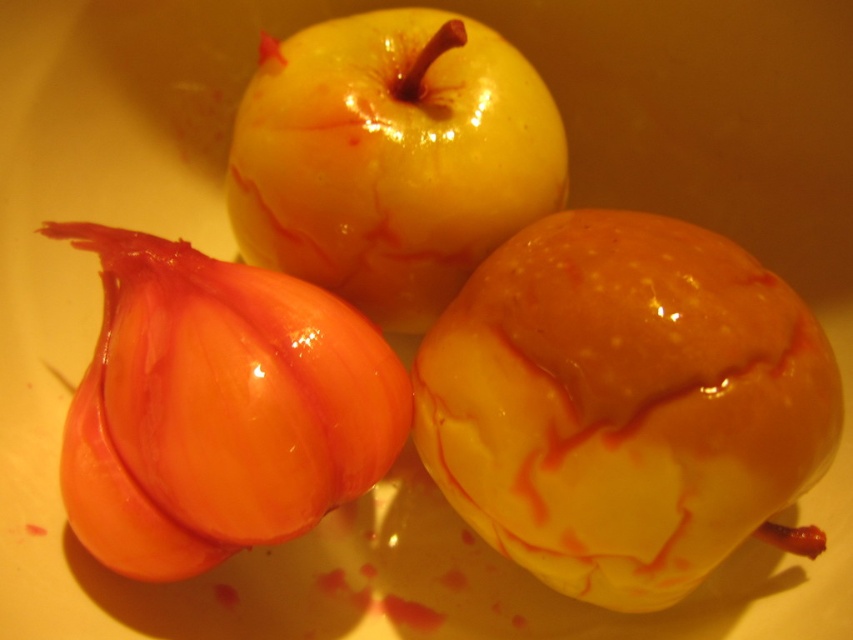
Is shiny orange onion at lower left behind yellow shiny apple at center?

No, shiny orange onion at lower left is closer to the viewer.

Between shiny orange onion at lower left and yellow shiny apple at center, which one has less height?

With less height is shiny orange onion at lower left.

Which is in front, point (196, 273) or point (357, 141)?

Point (196, 273) is more forward.

This screenshot has height=640, width=853. Find the location of `shiny orange onion at lower left`. shiny orange onion at lower left is located at coordinates (218, 406).